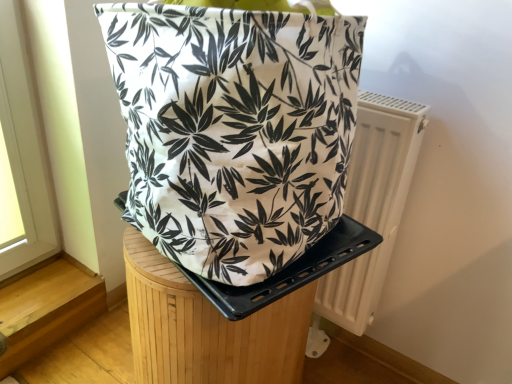
Describe the element at coordinates (207, 328) in the screenshot. Image resolution: width=512 pixels, height=384 pixels. I see `wooden stool at center` at that location.

Measure the distance between white plastic radiator at right and camera.

white plastic radiator at right and camera are 88.14 centimeters apart from each other.

The image size is (512, 384). Identify the location of white canvas bag at center. (234, 130).

The width and height of the screenshot is (512, 384). Identify the location of wooden stool at center. (207, 328).

Where is `furniture located behind the white canvas bag at center`? Image resolution: width=512 pixels, height=384 pixels. furniture located behind the white canvas bag at center is located at coordinates (207, 328).

Relative to white canvas bag at center, is wooden stool at center in front or behind?

Clearly, wooden stool at center is behind white canvas bag at center.

How different are the orientations of wooden stool at center and white canvas bag at center in degrees?

They differ by 4.44 degrees in their facing directions.

Is the surface of wooden stool at center in direct contact with white canvas bag at center?

No, wooden stool at center is not making contact with white canvas bag at center.

Do you think white plastic radiator at right is within wooden stool at center, or outside of it?

white plastic radiator at right is not enclosed by wooden stool at center.

Is white plastic radiator at right positioned with its back to wooden stool at center?

No, white plastic radiator at right's orientation is not away from wooden stool at center.

Considering the relative sizes of white plastic radiator at right and wooden stool at center in the image provided, is white plastic radiator at right shorter than wooden stool at center?

No.

From a real-world perspective, is white plastic radiator at right physically located above or below white canvas bag at center?

In terms of real-world spatial position, white plastic radiator at right is below white canvas bag at center.

Are white plastic radiator at right and white canvas bag at center located far from each other?

No.

Does white plastic radiator at right have a lesser width compared to white canvas bag at center?

Yes.

Is point (366, 104) positioned behind point (234, 83)?

Yes, point (366, 104) is behind point (234, 83).

In the scene shown: Considering the sizes of objects white canvas bag at center and white plastic radiator at right in the image provided, who is smaller, white canvas bag at center or white plastic radiator at right?

Smaller between the two is white plastic radiator at right.

From the image's perspective, is white canvas bag at center located above white plastic radiator at right?

Correct, white canvas bag at center appears higher than white plastic radiator at right in the image.

Consider the image. Is white canvas bag at center directly adjacent to white plastic radiator at right?

No, white canvas bag at center is not next to white plastic radiator at right.

From a real-world perspective, which is physically above, white canvas bag at center or white plastic radiator at right?

white canvas bag at center is physically above.

Is wooden stool at center to the left or to the right of white plastic radiator at right in the image?

Based on their positions, wooden stool at center is located to the left of white plastic radiator at right.

The width and height of the screenshot is (512, 384). In order to click on radiator positioned vertically above the wooden stool at center (from a real-world perspective) in this screenshot , I will do `click(373, 204)`.

Would you say wooden stool at center is inside or outside white plastic radiator at right?

wooden stool at center is outside white plastic radiator at right.

Is white plastic radiator at right at the back of wooden stool at center?

Absolutely, wooden stool at center is directed away from white plastic radiator at right.

Looking at this image, is white canvas bag at center positioned with its back to wooden stool at center?

white canvas bag at center is not turned away from wooden stool at center.

I want to click on furniture below the white canvas bag at center (from a real-world perspective), so click(207, 328).

Is white canvas bag at center bigger or smaller than wooden stool at center?

Considering their sizes, white canvas bag at center takes up more space than wooden stool at center.

Which object is positioned more to the left, white canvas bag at center or wooden stool at center?

Positioned to the left is wooden stool at center.

Find the location of a particular element. furniture that is below the white canvas bag at center (from the image's perspective) is located at coordinates (207, 328).

I want to click on radiator above the wooden stool at center (from a real-world perspective), so click(373, 204).

From the image, which object appears to be farther from white canvas bag at center, white plastic radiator at right or wooden stool at center?

white plastic radiator at right lies further to white canvas bag at center than the other object.

Estimate the real-world distances between objects in this image. Which object is further from wooden stool at center, white canvas bag at center or white plastic radiator at right?

white plastic radiator at right lies further to wooden stool at center than the other object.

Based on their spatial positions, is wooden stool at center or white canvas bag at center closer to white plastic radiator at right?

wooden stool at center is positioned closer to the anchor white plastic radiator at right.

Looking at this image, from the image, which object appears to be nearer to wooden stool at center, white plastic radiator at right or white canvas bag at center?

white canvas bag at center lies closer to wooden stool at center than the other object.

From the image, which object appears to be farther from white canvas bag at center, wooden stool at center or white plastic radiator at right?

white plastic radiator at right is positioned further to the anchor white canvas bag at center.

When comparing their distances from white plastic radiator at right, does white canvas bag at center or wooden stool at center seem further?

Among the two, white canvas bag at center is located further to white plastic radiator at right.

Locate an element on the screen. The image size is (512, 384). radiator between white canvas bag at center and wooden stool at center in the vertical direction is located at coordinates (373, 204).